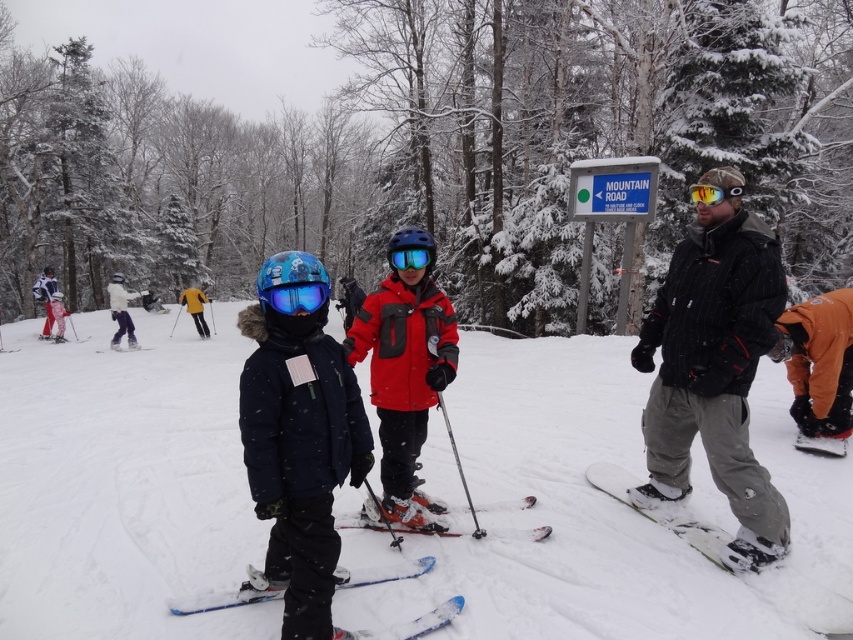
Does point (746, 243) lie in front of point (509, 531)?

Yes, it is.

Where is `black textured jacket at right`? Image resolution: width=853 pixels, height=640 pixels. black textured jacket at right is located at coordinates (714, 372).

What do you see at coordinates (410, 257) in the screenshot? The height and width of the screenshot is (640, 853). I see `tinted plastic goggles at center` at bounding box center [410, 257].

Who is more distant from viewer, (433, 256) or (129, 349)?

Positioned behind is point (129, 349).

Which is behind, point (426, 252) or point (115, 344)?

The point (115, 344) is behind.

Find the location of `tinted plastic goggles at center`. tinted plastic goggles at center is located at coordinates (410, 257).

Is orange metallic ski at center to the left of reflective yellow goggles at center from the viewer's perspective?

Yes, orange metallic ski at center is to the left of reflective yellow goggles at center.

Is the position of orange metallic ski at center less distant than that of reflective yellow goggles at center?

No, orange metallic ski at center is behind reflective yellow goggles at center.

Is point (453, 522) farther from camera compared to point (741, 192)?

Yes.

Image resolution: width=853 pixels, height=640 pixels. In order to click on orange metallic ski at center in this screenshot , I will do `click(444, 520)`.